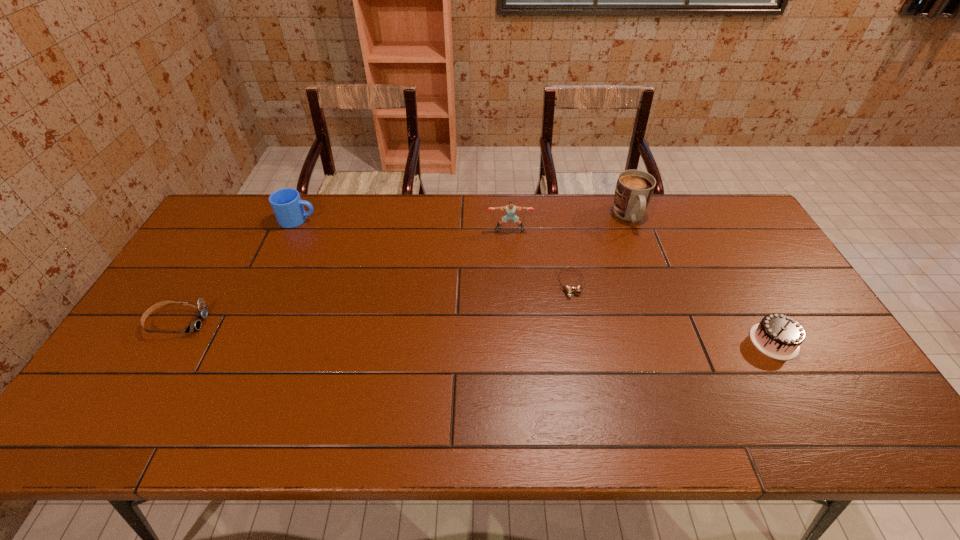
Find the location of a particular element. The image size is (960, 540). vacant region that satisfies the following two spatial constraints: 1. on the front lenses and sides of the right goggles; 2. on the front-facing side of the nearer goggles is located at coordinates (579, 322).

Locate an element on the screen. This screenshot has height=540, width=960. vacant region that satisfies the following two spatial constraints: 1. on the front-facing side of the third object from left to right; 2. on the left side of the chocolate cake is located at coordinates (517, 341).